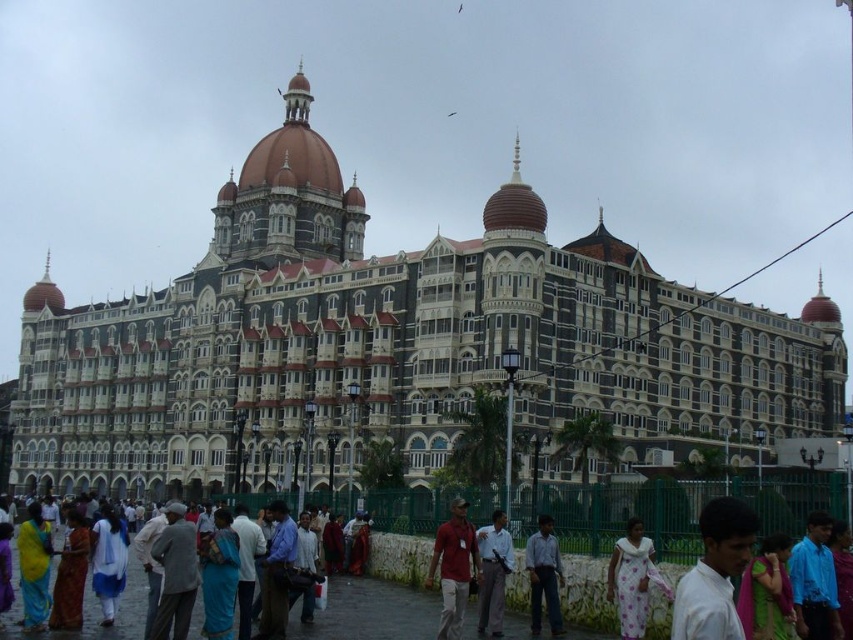
Question: Which of these objects is positioned farthest from the light blue shirt at center?

Choices:
 (A) blue cotton saree at lower left
 (B) white floral dress at lower center

Answer: (A)

Question: Which object is farther from the camera taking this photo?

Choices:
 (A) white stone building at center
 (B) white floral dress at lower center
 (C) green silk saree at center
 (D) matte yellow sari at lower left

Answer: (A)

Question: Is white shirt at lower right positioned before blue shirt at center?

Choices:
 (A) yes
 (B) no

Answer: (A)

Question: Is white shirt at lower right bigger than light blue shirt at center?

Choices:
 (A) yes
 (B) no

Answer: (A)

Question: Does green silk saree at center appear over white cotton shirt at center?

Choices:
 (A) no
 (B) yes

Answer: (B)

Question: Which point appears farthest from the camera in this image?

Choices:
 (A) (741, 536)
 (B) (148, 339)
 (C) (625, 624)

Answer: (B)